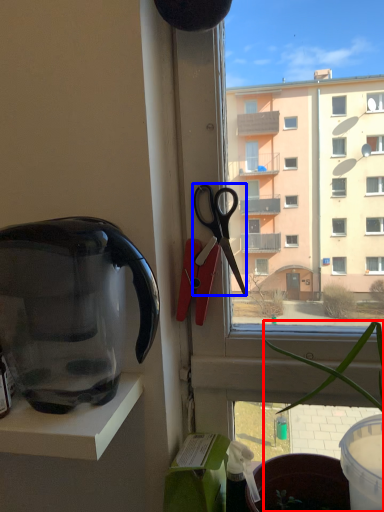
Question: Which of the following is the closest to the observer, houseplant (highlighted by a red box) or scissors (highlighted by a blue box)?

Choices:
 (A) houseplant
 (B) scissors

Answer: (A)